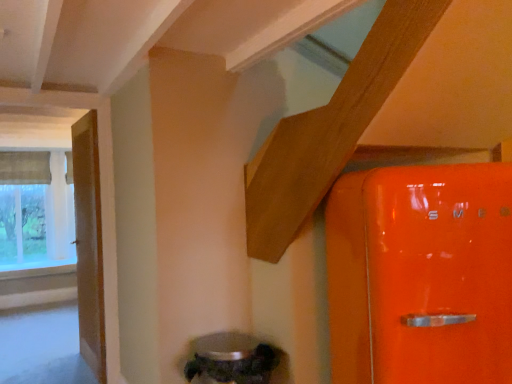
Question: Does clear glass window sill at lower left have a larger size compared to metallic silver water heater at lower center?

Choices:
 (A) no
 (B) yes

Answer: (B)

Question: Can you confirm if clear glass window sill at lower left is smaller than metallic silver water heater at lower center?

Choices:
 (A) no
 (B) yes

Answer: (A)

Question: Can you confirm if clear glass window sill at lower left is wider than metallic silver water heater at lower center?

Choices:
 (A) yes
 (B) no

Answer: (A)

Question: Can you confirm if clear glass window sill at lower left is shorter than metallic silver water heater at lower center?

Choices:
 (A) yes
 (B) no

Answer: (A)

Question: Considering the relative sizes of clear glass window sill at lower left and metallic silver water heater at lower center in the image provided, is clear glass window sill at lower left thinner than metallic silver water heater at lower center?

Choices:
 (A) yes
 (B) no

Answer: (B)

Question: Is clear glass window sill at lower left oriented away from metallic silver water heater at lower center?

Choices:
 (A) no
 (B) yes

Answer: (A)

Question: Does textured fabric window at left appear on the left side of clear glass window sill at lower left?

Choices:
 (A) no
 (B) yes

Answer: (B)

Question: From a real-world perspective, is textured fabric window at left on clear glass window sill at lower left?

Choices:
 (A) yes
 (B) no

Answer: (A)

Question: Can you confirm if textured fabric window at left is positioned to the right of clear glass window sill at lower left?

Choices:
 (A) no
 (B) yes

Answer: (A)

Question: Is textured fabric window at left outside of clear glass window sill at lower left?

Choices:
 (A) no
 (B) yes

Answer: (B)

Question: From the image's perspective, would you say textured fabric window at left is positioned over clear glass window sill at lower left?

Choices:
 (A) no
 (B) yes

Answer: (B)

Question: Does textured fabric window at left have a lesser height compared to clear glass window sill at lower left?

Choices:
 (A) yes
 (B) no

Answer: (B)

Question: Is metallic silver water heater at lower center wider than wooden door at left?

Choices:
 (A) yes
 (B) no

Answer: (A)